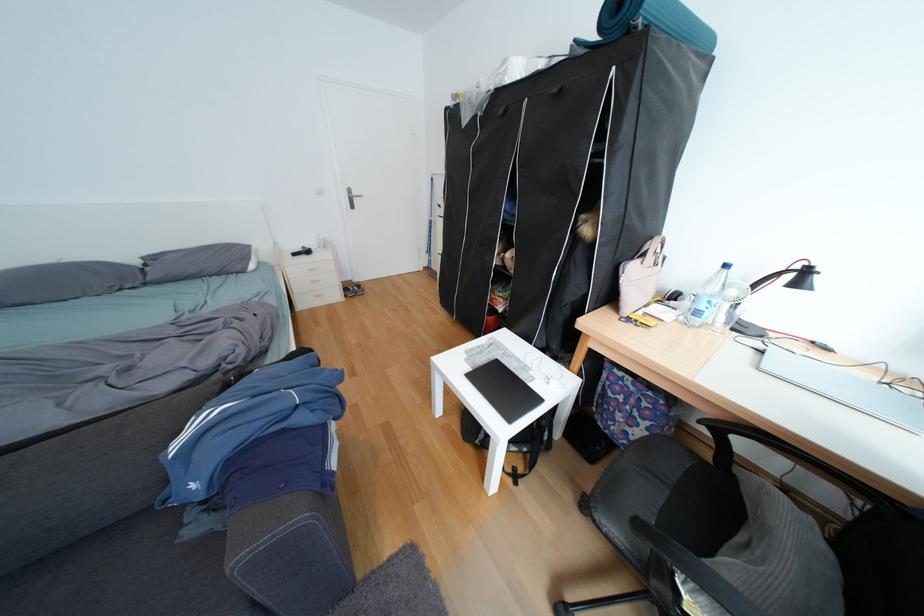
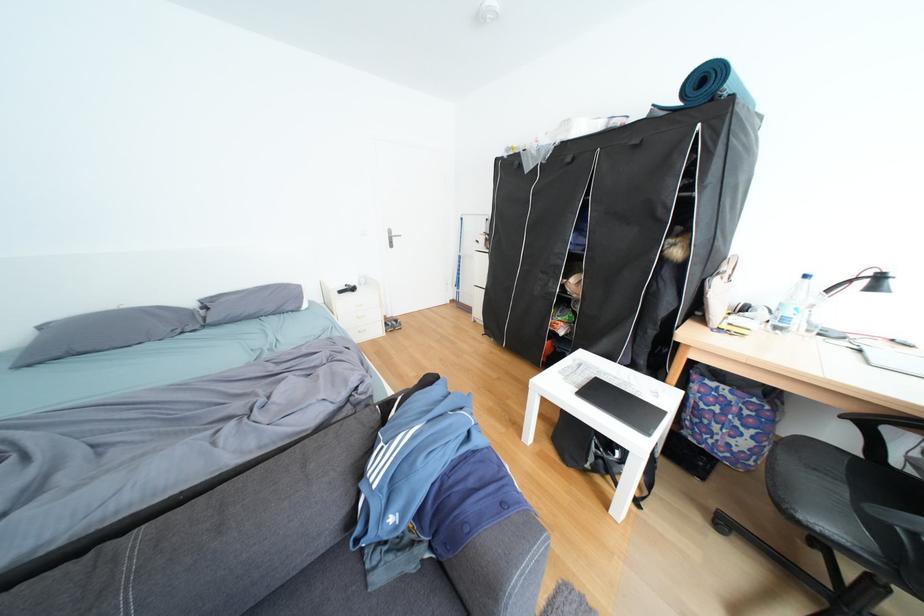
Question: How did the camera likely rotate?

Choices:
 (A) Left
 (B) Right
 (C) Up
 (D) Down

Answer: (C)